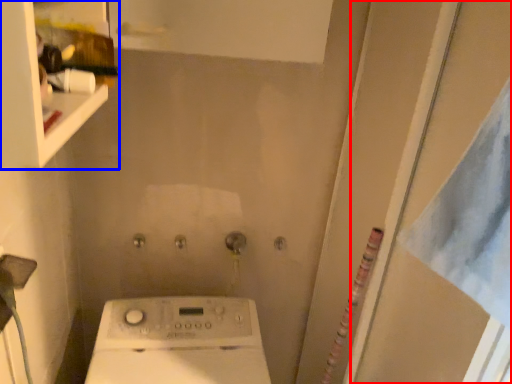
Question: Among these objects, which one is nearest to the camera, screen door (highlighted by a red box) or shelf (highlighted by a blue box)?

Choices:
 (A) screen door
 (B) shelf

Answer: (B)